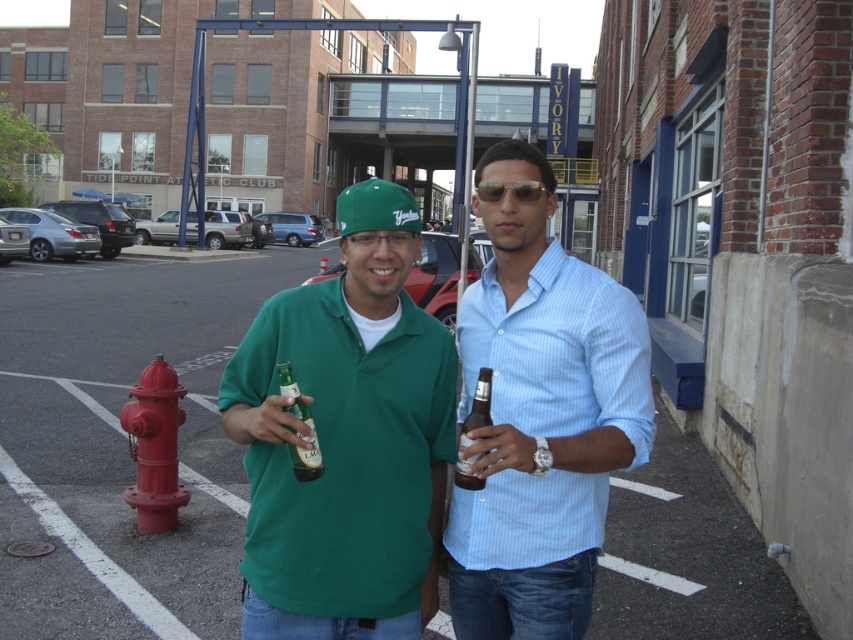
Question: Estimate the real-world distances between objects in this image. Which object is farther from the gold metallic sunglasses at center?

Choices:
 (A) brown glass bottle at center
 (B) red matte fire hydrant at lower left
 (C) green glass bottle at center
 (D) light blue striped shirt at center

Answer: (B)

Question: Does green matte shirt at center have a lesser width compared to gold metallic sunglasses at center?

Choices:
 (A) yes
 (B) no

Answer: (B)

Question: Observing the image, what is the correct spatial positioning of green matte shirt at center in reference to light blue striped shirt at center?

Choices:
 (A) below
 (B) above

Answer: (A)

Question: Which object appears farthest from the camera in this image?

Choices:
 (A) gold metallic sunglasses at center
 (B) green glass bottle at center
 (C) red matte fire hydrant at lower left

Answer: (C)

Question: Which object is closer to the camera taking this photo?

Choices:
 (A) green matte shirt at center
 (B) green glass bottle at center
 (C) red matte fire hydrant at lower left

Answer: (B)

Question: Is green glass bottle at center to the right of brown glass bottle at center from the viewer's perspective?

Choices:
 (A) yes
 (B) no

Answer: (B)